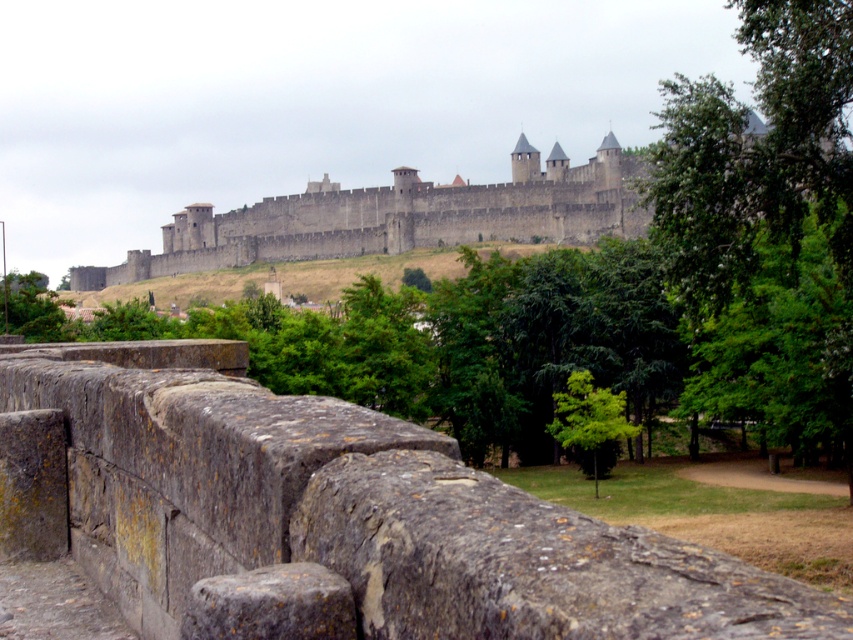
Question: Which point is farther from the camera taking this photo?

Choices:
 (A) (126, 269)
 (B) (592, 410)
 (C) (751, 406)

Answer: (A)

Question: Is rusty stone ledge at center thinner than gray stone wall at upper center?

Choices:
 (A) yes
 (B) no

Answer: (A)

Question: Which of the following is the farthest from the observer?

Choices:
 (A) (10, 298)
 (B) (776, 426)

Answer: (A)

Question: Is green leafy tree at upper right to the right of green leafy tree at lower left from the viewer's perspective?

Choices:
 (A) no
 (B) yes

Answer: (B)

Question: Is rusty stone ledge at center positioned before gray stone wall at upper center?

Choices:
 (A) yes
 (B) no

Answer: (A)

Question: Which point is closer to the camera?

Choices:
 (A) (618, 221)
 (B) (622, 410)
 (C) (234, 401)

Answer: (C)